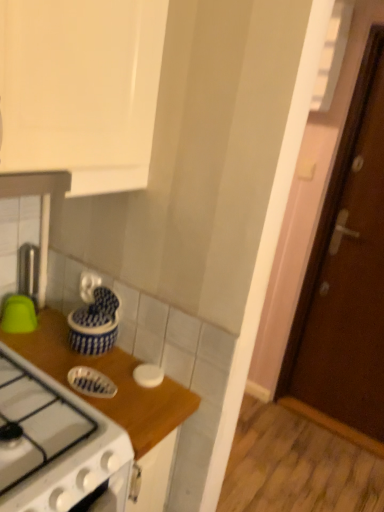
At what (x,y) coordinates should I click in order to perform the action: click on vacant area in front of blue glossy jar at center, which is counted as the second kitchen appliance, starting from the left. Please return your answer as a coordinate pair (x, y). The image size is (384, 512). Looking at the image, I should click on click(95, 379).